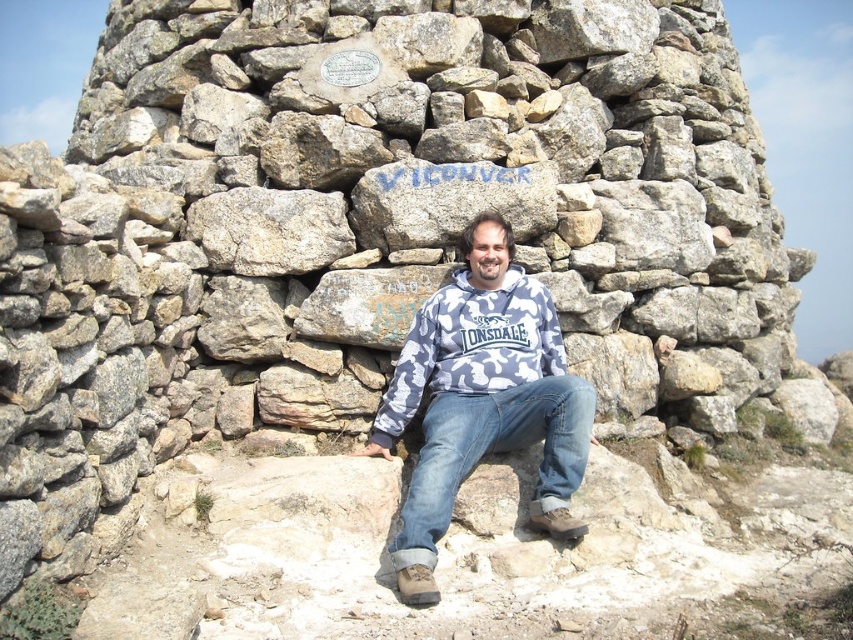
Question: Estimate the real-world distances between objects in this image. Which object is farther from the blue denim jeans at center?

Choices:
 (A) camo fabric hoodie at center
 (B) camouflage hoodie at center

Answer: (A)

Question: Can you confirm if camouflage hoodie at center is positioned to the left of blue denim jeans at center?

Choices:
 (A) no
 (B) yes

Answer: (B)

Question: Can you confirm if camouflage hoodie at center is positioned to the left of blue denim jeans at center?

Choices:
 (A) yes
 (B) no

Answer: (A)

Question: Which of the following is the farthest from the observer?

Choices:
 (A) (488, 412)
 (B) (447, 346)
 (C) (496, 442)

Answer: (B)

Question: Is camouflage hoodie at center positioned before camo fabric hoodie at center?

Choices:
 (A) no
 (B) yes

Answer: (B)

Question: Which point is closer to the camera?

Choices:
 (A) (480, 388)
 (B) (404, 509)
 (C) (462, 372)

Answer: (B)